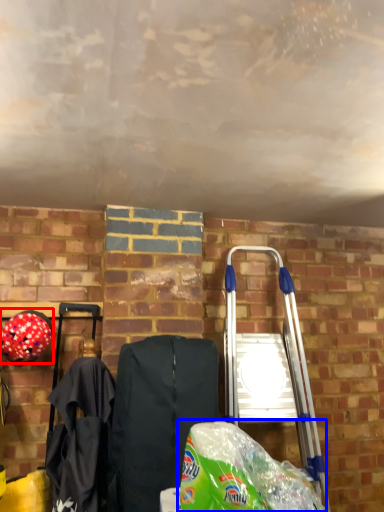
Question: Which point is closer to the camera, helmet (highlighted by a red box) or grocery bag (highlighted by a blue box)?

Choices:
 (A) helmet
 (B) grocery bag

Answer: (B)